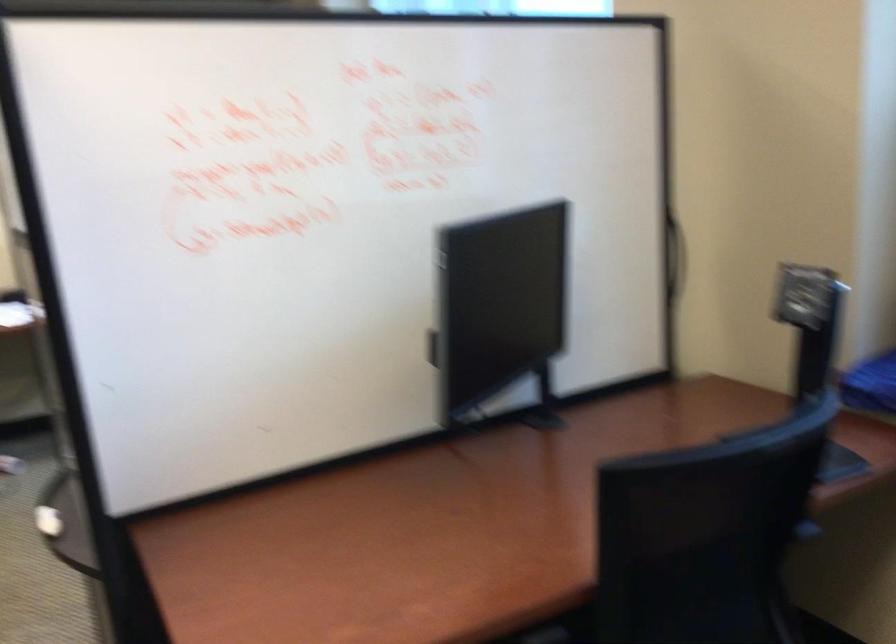
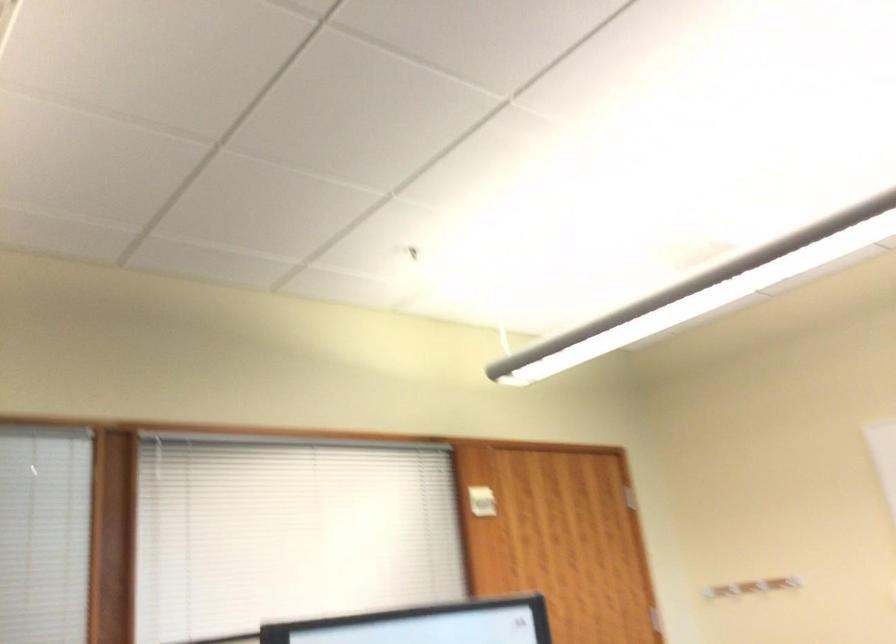
First-person continuous shooting, in which direction is the camera rotating?

The camera rotated toward left-up.